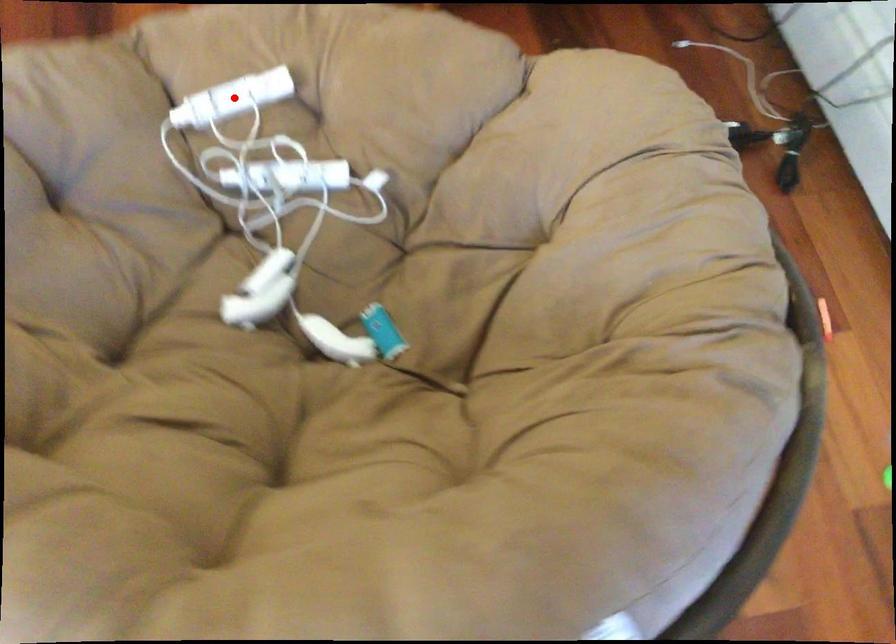
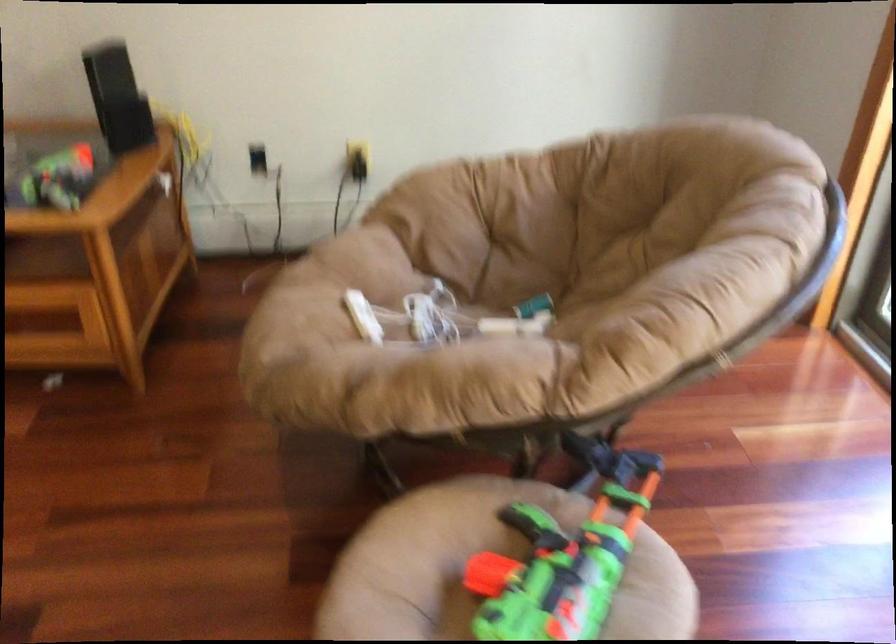
Question: I am providing you with two images of the same scene from different viewpoints. In image1, a red point is highlighted. Considering the same 3D point in image2, which of the following is correct?

Choices:
 (A) It is closer
 (B) It is farther

Answer: (B)